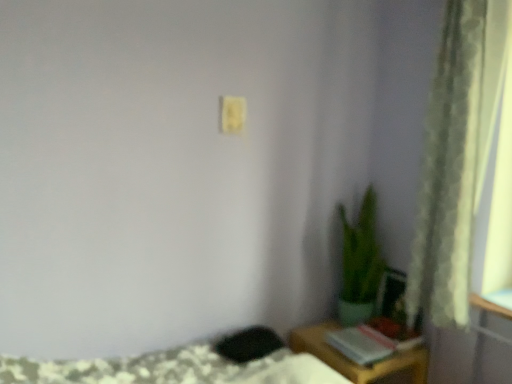
Question: Can you confirm if green matte plant at lower right is smaller than green textured curtain at right?

Choices:
 (A) yes
 (B) no

Answer: (B)

Question: Does green matte plant at lower right lie in front of green textured curtain at right?

Choices:
 (A) no
 (B) yes

Answer: (A)

Question: Can you confirm if green matte plant at lower right is positioned to the right of green textured curtain at right?

Choices:
 (A) no
 (B) yes

Answer: (A)

Question: Does green matte plant at lower right have a lesser height compared to green textured curtain at right?

Choices:
 (A) no
 (B) yes

Answer: (B)

Question: Can you confirm if green matte plant at lower right is taller than green textured curtain at right?

Choices:
 (A) yes
 (B) no

Answer: (B)

Question: In the image, is green textured curtain at right positioned in front of or behind yellow matte light switch at upper center?

Choices:
 (A) behind
 (B) front

Answer: (B)

Question: Visually, is green textured curtain at right positioned to the left or to the right of yellow matte light switch at upper center?

Choices:
 (A) left
 (B) right

Answer: (B)

Question: From their relative heights in the image, would you say green textured curtain at right is taller or shorter than yellow matte light switch at upper center?

Choices:
 (A) tall
 (B) short

Answer: (A)

Question: From the image's perspective, is green textured curtain at right above or below yellow matte light switch at upper center?

Choices:
 (A) above
 (B) below

Answer: (B)

Question: From the image's perspective, is green textured curtain at right positioned above or below hardcover book at lower right?

Choices:
 (A) below
 (B) above

Answer: (B)

Question: Would you say green textured curtain at right is inside or outside hardcover book at lower right?

Choices:
 (A) outside
 (B) inside

Answer: (A)

Question: From a real-world perspective, is green textured curtain at right positioned above or below hardcover book at lower right?

Choices:
 (A) below
 (B) above

Answer: (B)

Question: Visually, is green textured curtain at right positioned to the left or to the right of hardcover book at lower right?

Choices:
 (A) right
 (B) left

Answer: (A)

Question: In the image, is yellow matte light switch at upper center positioned in front of or behind hardcover book at lower right?

Choices:
 (A) behind
 (B) front

Answer: (B)

Question: Do you think yellow matte light switch at upper center is within hardcover book at lower right, or outside of it?

Choices:
 (A) inside
 (B) outside

Answer: (B)